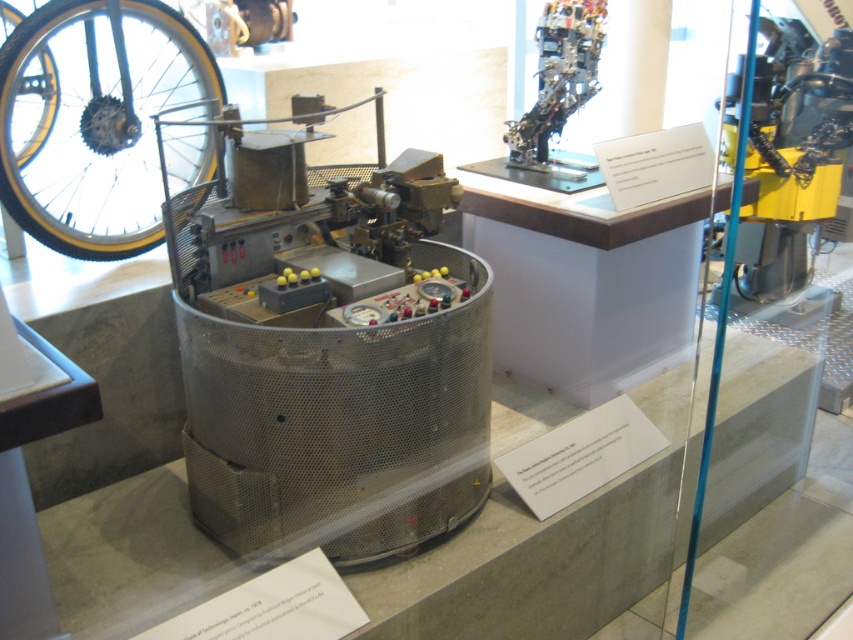
Find the location of `metallic mesh machine at center`. metallic mesh machine at center is located at coordinates (328, 349).

Who is more distant from viewer, (363, 220) or (68, 99)?

The point (68, 99) is behind.

This screenshot has height=640, width=853. What do you see at coordinates (328, 349) in the screenshot?
I see `metallic mesh machine at center` at bounding box center [328, 349].

The height and width of the screenshot is (640, 853). What are the coordinates of `metallic mesh machine at center` in the screenshot? It's located at (328, 349).